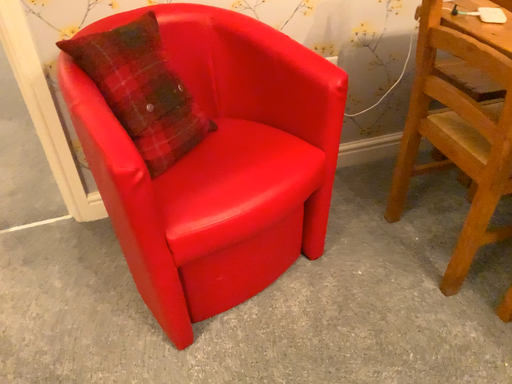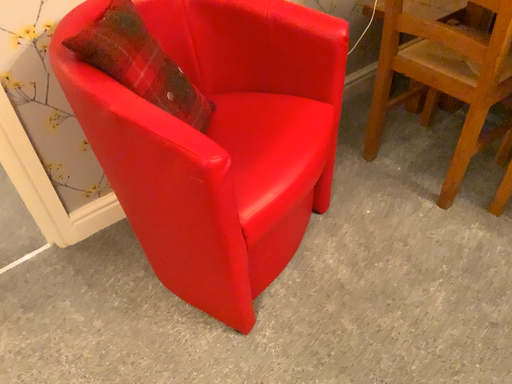
Question: How did the camera likely rotate when shooting the video?

Choices:
 (A) rotated right
 (B) rotated left

Answer: (A)